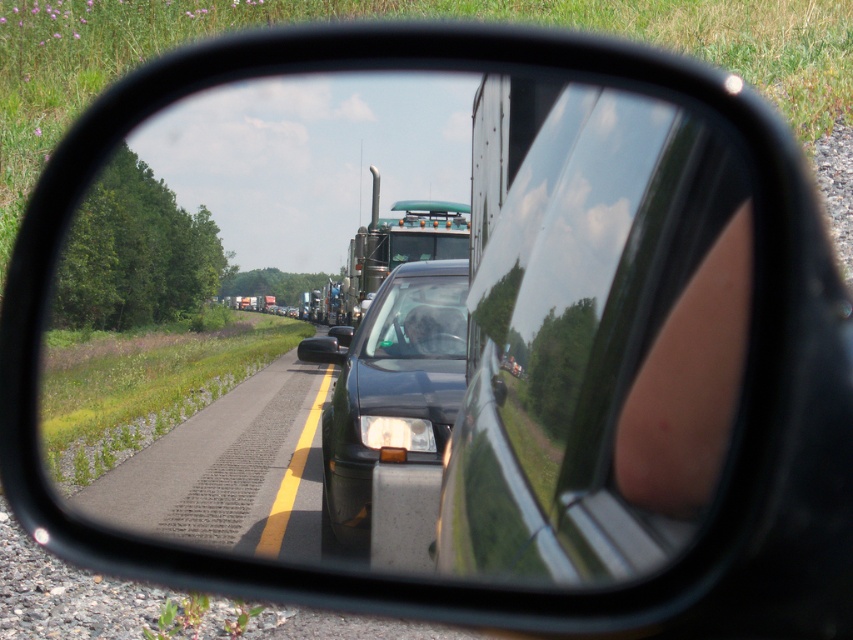
This screenshot has height=640, width=853. In order to click on glossy metallic mirror at center in this screenshot , I will do `click(601, 348)`.

Locate an element on the screen. The width and height of the screenshot is (853, 640). glossy metallic mirror at center is located at coordinates (601, 348).

This screenshot has height=640, width=853. I want to click on glossy metallic mirror at center, so click(601, 348).

From the picture: Between glossy metallic mirror at center and shiny black sedan at center, which one has more height?

Standing taller between the two is shiny black sedan at center.

Is glossy metallic mirror at center smaller than shiny black sedan at center?

Yes.

Describe the element at coordinates (601, 348) in the screenshot. I see `glossy metallic mirror at center` at that location.

Locate an element on the screen. This screenshot has width=853, height=640. glossy metallic mirror at center is located at coordinates (601, 348).

Which is below, asphalt road at lower left or shiny black sedan at center?

asphalt road at lower left is lower down.

Is point (218, 492) closer to viewer compared to point (437, 444)?

No, it is behind (437, 444).

This screenshot has width=853, height=640. I want to click on asphalt road at lower left, so click(x=229, y=468).